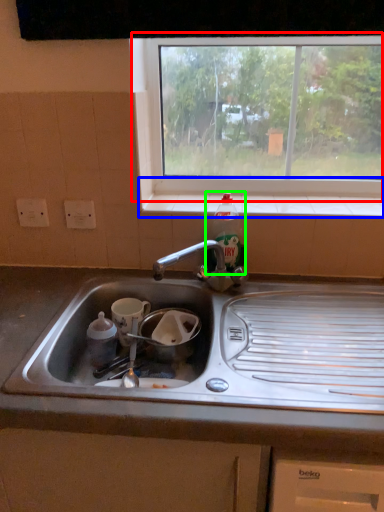
Question: Considering the real-world distances, which object is farthest from window (highlighted by a red box)? window sill (highlighted by a blue box) or bottle (highlighted by a green box)?

Choices:
 (A) window sill
 (B) bottle

Answer: (B)